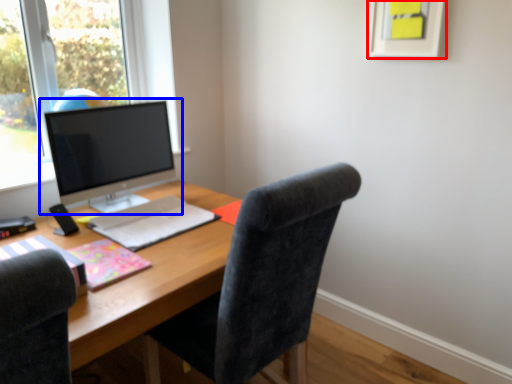
Question: Which of the following is the closest to the observer, picture frame (highlighted by a red box) or computer monitor (highlighted by a blue box)?

Choices:
 (A) picture frame
 (B) computer monitor

Answer: (A)